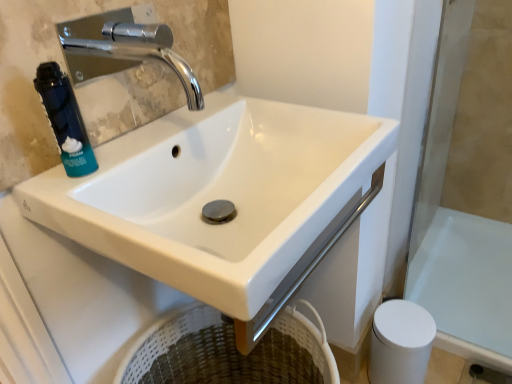
What do you see at coordinates (65, 120) in the screenshot? I see `blue matte foam canister at left` at bounding box center [65, 120].

At what (x,y) coordinates should I click in order to perform the action: click on white glossy bath at lower right. Please return your answer as a coordinate pair (x, y). The image size is (512, 384). Looking at the image, I should click on [x=466, y=285].

Identify the location of bath below the blue matte foam canister at left (from the image's perspective). The height and width of the screenshot is (384, 512). (466, 285).

In terms of width, does blue matte foam canister at left look wider or thinner when compared to white glossy bath at lower right?

In the image, blue matte foam canister at left appears to be more narrow than white glossy bath at lower right.

Is blue matte foam canister at left situated inside white glossy bath at lower right or outside?

blue matte foam canister at left exists outside the volume of white glossy bath at lower right.

How many degrees apart are the facing directions of blue matte foam canister at left and white glossy bath at lower right?

179 degrees.

Considering the sizes of white glossy sink at center and blue matte foam canister at left in the image, is white glossy sink at center bigger or smaller than blue matte foam canister at left?

Clearly, white glossy sink at center is larger in size than blue matte foam canister at left.

At what (x,y) coordinates should I click in order to perform the action: click on sink that appears on the right of blue matte foam canister at left. Please return your answer as a coordinate pair (x, y). Image resolution: width=512 pixels, height=384 pixels. Looking at the image, I should click on (216, 194).

Are white glossy sink at center and blue matte foam canister at left making contact?

white glossy sink at center and blue matte foam canister at left are not in contact.

Which is behind, point (154, 42) or point (77, 104)?

Point (154, 42)

Could you tell me if chrome metallic faucet at upper left is facing blue matte foam canister at left?

No, chrome metallic faucet at upper left is not facing towards blue matte foam canister at left.

Is chrome metallic faucet at upper left placed right next to blue matte foam canister at left?

No.

At what (x,y) coordinates should I click in order to perform the action: click on toilet paper below the blue matte foam canister at left (from the image's perspective). Please return your answer as a coordinate pair (x, y). This screenshot has width=512, height=384. Looking at the image, I should click on (x=400, y=343).

Is white matte toilet paper at lower right shorter than blue matte foam canister at left?

In fact, white matte toilet paper at lower right may be taller than blue matte foam canister at left.

Which is closer to the camera, [424,364] or [50,72]?

The point [50,72] is closer to the camera.

From the image's perspective, relative to blue matte foam canister at left, is white glossy bath at lower right above or below?

Clearly, from the image's perspective, white glossy bath at lower right is below blue matte foam canister at left.

From the picture: Is white glossy bath at lower right positioned in front of blue matte foam canister at left?

That is False.

Is white glossy bath at lower right aimed at blue matte foam canister at left?

No, white glossy bath at lower right is not facing towards blue matte foam canister at left.

Considering the relative sizes of white glossy bath at lower right and blue matte foam canister at left in the image provided, is white glossy bath at lower right wider than blue matte foam canister at left?

Indeed, white glossy bath at lower right has a greater width compared to blue matte foam canister at left.

How far apart are blue matte foam canister at left and chrome metallic faucet at upper left?

blue matte foam canister at left and chrome metallic faucet at upper left are 3.50 feet apart.

Is point (62, 101) farther from viewer compared to point (195, 77)?

No.

Are blue matte foam canister at left and chrome metallic faucet at upper left far apart?

That's right, there is a large distance between blue matte foam canister at left and chrome metallic faucet at upper left.

From the image's perspective, relative to chrome metallic faucet at upper left, is blue matte foam canister at left above or below?

Clearly, from the image's perspective, blue matte foam canister at left is below chrome metallic faucet at upper left.

From their relative heights in the image, would you say blue matte foam canister at left is taller or shorter than white matte toilet paper at lower right?

Clearly, blue matte foam canister at left is shorter compared to white matte toilet paper at lower right.

Does blue matte foam canister at left have a lesser width compared to white matte toilet paper at lower right?

Correct, the width of blue matte foam canister at left is less than that of white matte toilet paper at lower right.

Where is `mouthwash above the white glossy bath at lower right (from the image's perspective)`? The width and height of the screenshot is (512, 384). mouthwash above the white glossy bath at lower right (from the image's perspective) is located at coordinates (65, 120).

At what (x,y) coordinates should I click in order to perform the action: click on mouthwash that appears behind the white glossy sink at center. Please return your answer as a coordinate pair (x, y). The height and width of the screenshot is (384, 512). Looking at the image, I should click on 65,120.

When comparing their distances from white glossy bath at lower right, does blue matte foam canister at left or chrome metallic faucet at upper left seem closer?

The object closer to white glossy bath at lower right is blue matte foam canister at left.

Estimate the real-world distances between objects in this image. Which object is closer to white matte toilet paper at lower right, blue matte foam canister at left or chrome metallic faucet at upper left?

blue matte foam canister at left.

Based on the photo, based on their spatial positions, is white matte toilet paper at lower right or blue matte foam canister at left closer to white glossy sink at center?

Among the two, blue matte foam canister at left is located nearer to white glossy sink at center.

From the image, which object appears to be nearer to white glossy bath at lower right, chrome metallic faucet at upper left or white matte toilet paper at lower right?

Based on the image, white matte toilet paper at lower right appears to be nearer to white glossy bath at lower right.

Considering their positions, is white glossy sink at center positioned further to white matte toilet paper at lower right than chrome metallic faucet at upper left?

chrome metallic faucet at upper left is further to white matte toilet paper at lower right.

Which object lies further to the anchor point chrome metallic faucet at upper left, white matte toilet paper at lower right or white glossy bath at lower right?

white glossy bath at lower right.

In the scene shown: Looking at the image, which one is located closer to white matte toilet paper at lower right, white glossy sink at center or white glossy bath at lower right?

The object closer to white matte toilet paper at lower right is white glossy bath at lower right.

Looking at the image, which one is located closer to blue matte foam canister at left, white matte toilet paper at lower right or chrome metallic faucet at upper left?

white matte toilet paper at lower right is positioned closer to the anchor blue matte foam canister at left.

Image resolution: width=512 pixels, height=384 pixels. What are the coordinates of `sink situated between blue matte foam canister at left and white matte toilet paper at lower right from left to right` in the screenshot? It's located at (216, 194).

The width and height of the screenshot is (512, 384). Identify the location of toilet paper between blue matte foam canister at left and white glossy bath at lower right from left to right. (400, 343).

Where is `tap located between white glossy sink at center and white matte toilet paper at lower right in the depth direction`? tap located between white glossy sink at center and white matte toilet paper at lower right in the depth direction is located at coordinates (123, 49).

Identify the location of toilet paper between chrome metallic faucet at upper left and white glossy bath at lower right in the horizontal direction. This screenshot has width=512, height=384. (400, 343).